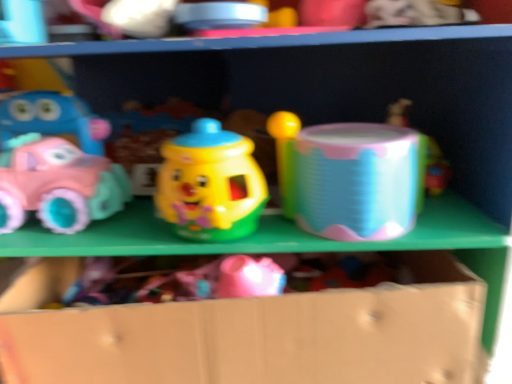
Question: In terms of size, does matte pink plastic car at left, the 1th toy in the left-to-right sequence, appear bigger or smaller than shiny plastic toy at center, which is the 3th toy in right-to-left order?

Choices:
 (A) big
 (B) small

Answer: (A)

Question: From their relative heights in the image, would you say matte pink plastic car at left, the 1th toy in the left-to-right sequence, is taller or shorter than shiny plastic toy at center, which is the second toy from left to right?

Choices:
 (A) short
 (B) tall

Answer: (A)

Question: Based on their relative distances, which object is nearer to the translucent plastic cup at upper right, placed as the 4th toy when sorted from left to right?

Choices:
 (A) cardboard box at lower center
 (B) matte pink plastic car at left, the 1th toy in the left-to-right sequence
 (C) shiny plastic toy at center, which is the 3th toy in right-to-left order
 (D) holographic plastic drum at center, which appears as the third toy when viewed from the left

Answer: (D)

Question: Which is farther from the holographic plastic drum at center, which appears as the third toy when viewed from the left?

Choices:
 (A) translucent plastic cup at upper right, which is counted as the first toy, starting from the right
 (B) cardboard box at lower center
 (C) shiny plastic toy at center, which is the second toy from left to right
 (D) matte pink plastic car at left, the 1th toy in the left-to-right sequence

Answer: (D)